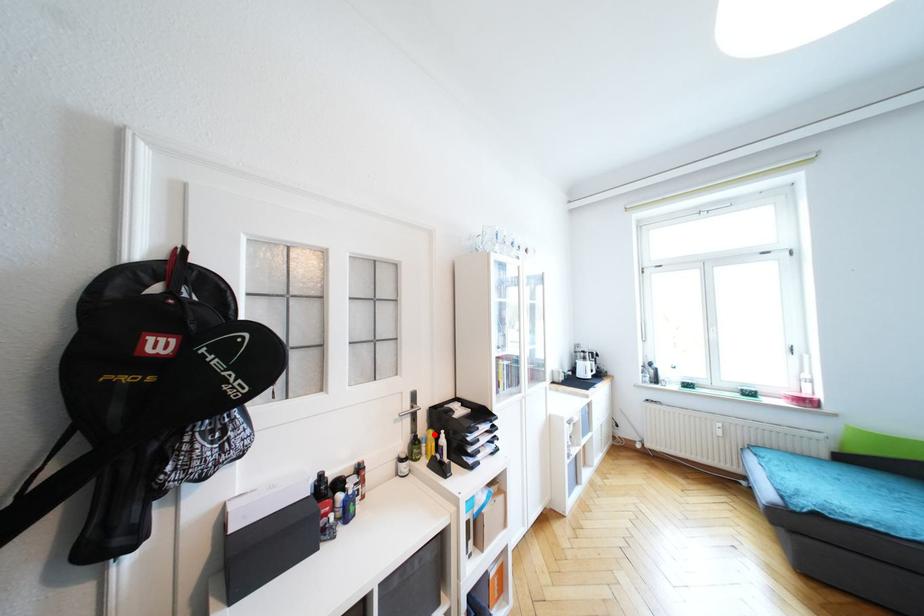
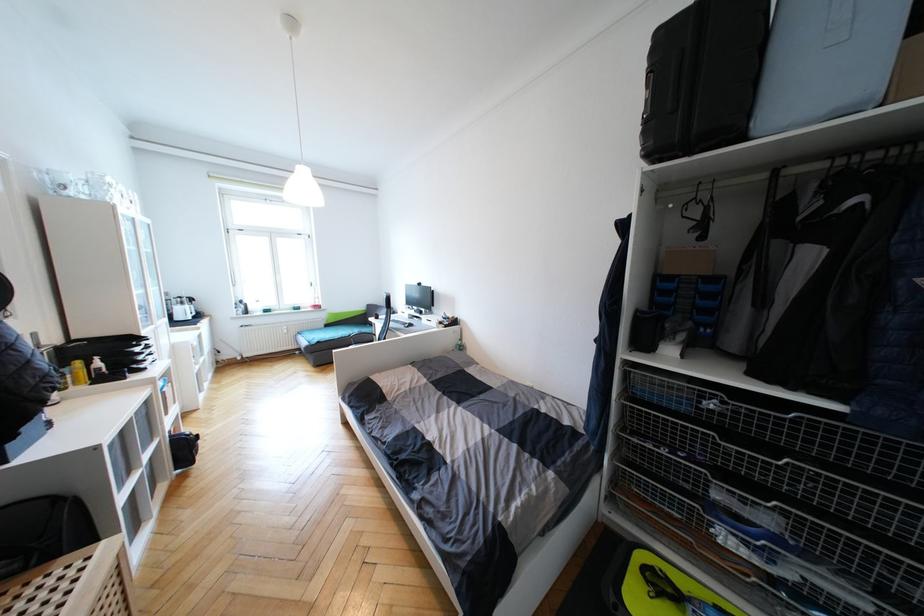
Question: I am providing you with two images of the same scene from different viewpoints. A red point is shown in image1. For the corresponding object point in image2, is it positioned nearer or farther from the camera?

Choices:
 (A) Nearer
 (B) Farther

Answer: (B)